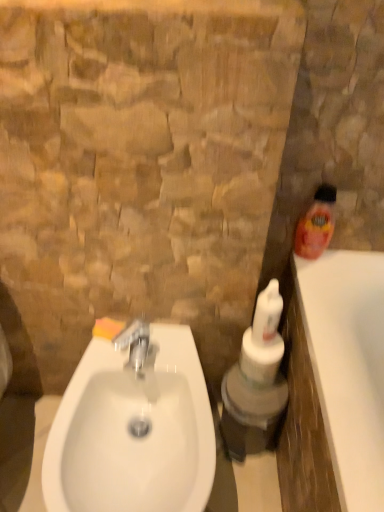
The width and height of the screenshot is (384, 512). I want to click on free location to the right of orange sponge at sink left, so click(x=171, y=355).